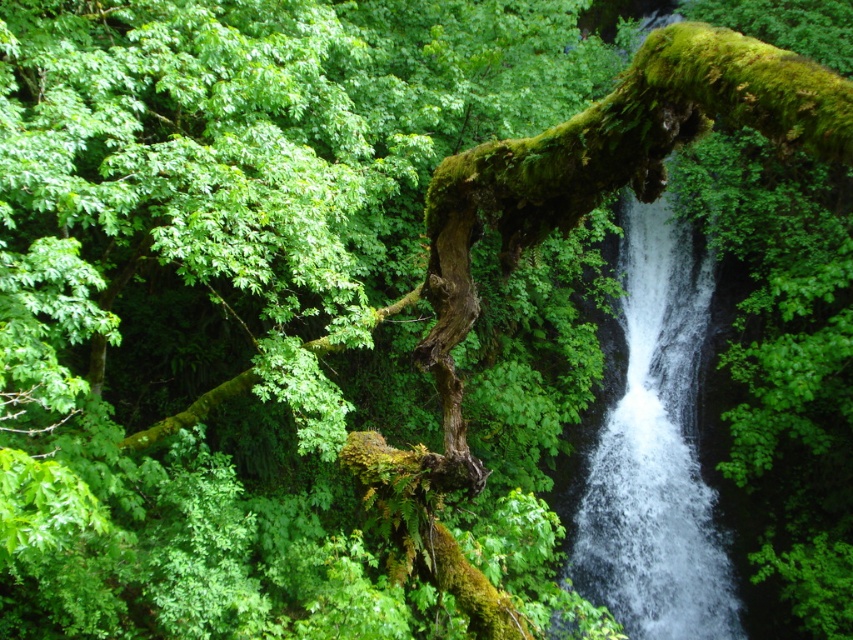
You are a hiker who wants to cross the green mossy branch at center to reach the other side. However, you notice the white frothy water at center nearby. Is the branch safe to walk on, considering its position relative to the water?

The green mossy branch at center is positioned under the white frothy water at center, which means the branch is likely wet and slippery from the falling water. This makes it unsafe to walk on.

You are an environmental scientist assessing the forest ecosystem. You observe the green mossy branch at center and the white frothy water at center. Which of these two features takes up more area in the scene?

The white frothy water at center occupies more area than the green mossy branch at center because the description states that the green mossy branch at center occupies less space than white frothy water at center.

In the scene shown: You are a hiker navigating through the forest and spot a mossy branch in the center of the scene. There is a specific point marked at coordinates point (606, 173). Can you confirm if this point is located on the green mossy branch at center?

Yes, the point (606, 173) is on the green mossy branch at center as stated in the objects description.